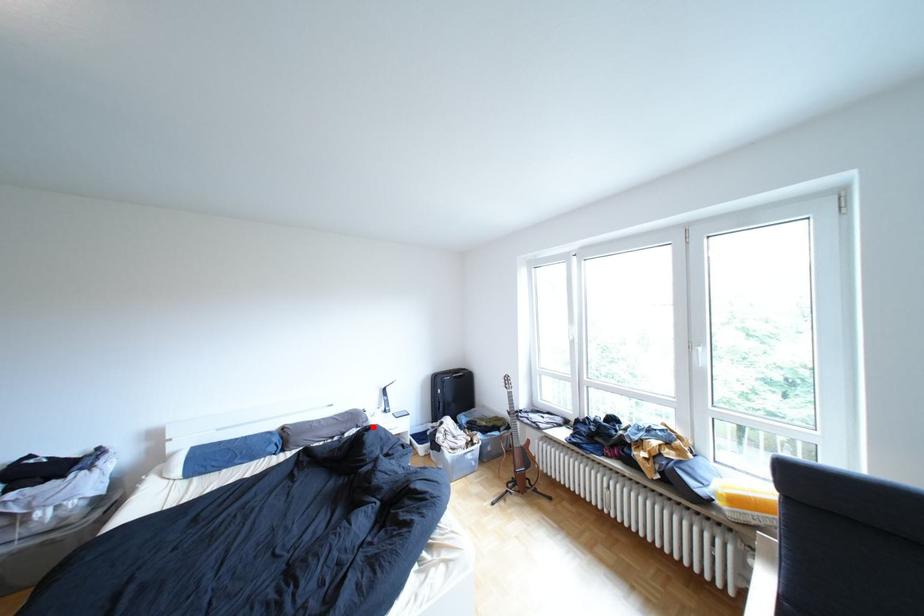
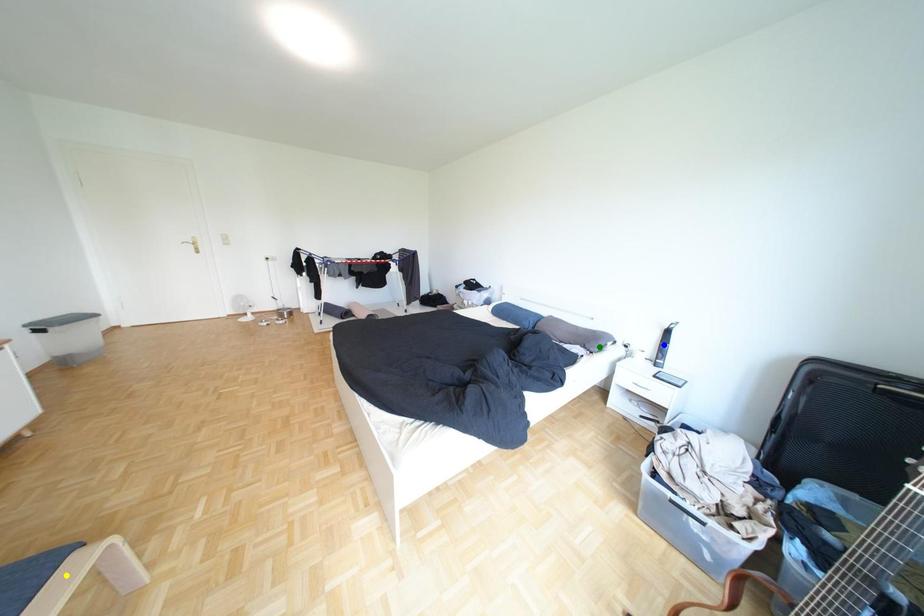
Question: I am providing you with two images of the same scene from different viewpoints. A red point is marked on the first image. You are given multiple points on the second image. Which point in image 2 is actually the same real-world point as the red point in image 1?

Choices:
 (A) yellow point
 (B) blue point
 (C) green point

Answer: (C)